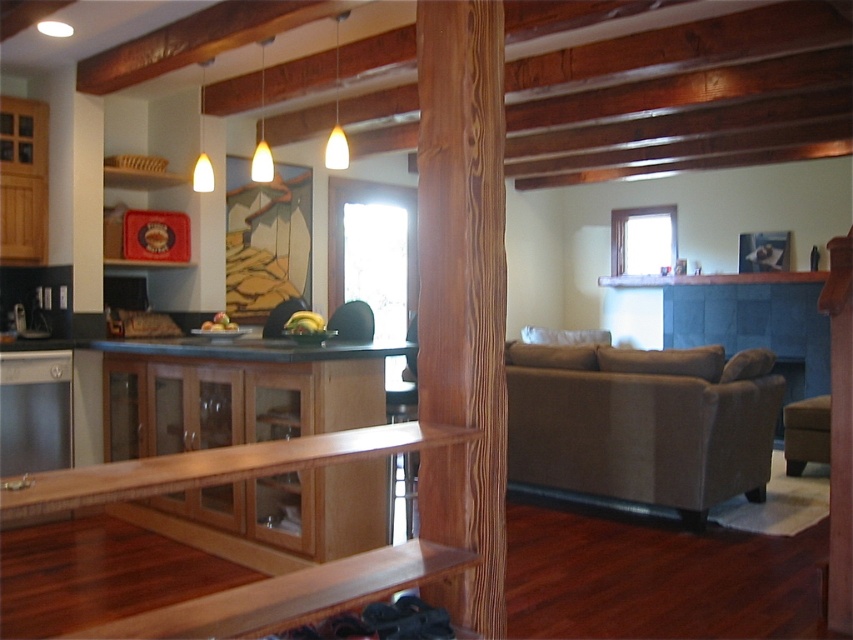
Question: Based on their relative distances, which object is nearer to the beige fabric couch at lower right?

Choices:
 (A) brown leather stool at lower right
 (B) satin stainless steel dishwasher at left

Answer: (A)

Question: Can you confirm if satin stainless steel dishwasher at left is positioned below brown leather stool at lower right?

Choices:
 (A) no
 (B) yes

Answer: (A)

Question: Considering the relative positions of beige fabric couch at lower right and brown leather stool at lower right in the image provided, where is beige fabric couch at lower right located with respect to brown leather stool at lower right?

Choices:
 (A) above
 (B) below

Answer: (A)

Question: Which point appears closest to the camera in this image?

Choices:
 (A) (821, 444)
 (B) (65, 433)

Answer: (B)

Question: Does beige fabric couch at lower right appear over satin stainless steel dishwasher at left?

Choices:
 (A) no
 (B) yes

Answer: (A)

Question: Among these points, which one is nearest to the camera?

Choices:
 (A) click(16, 392)
 (B) click(801, 444)

Answer: (A)